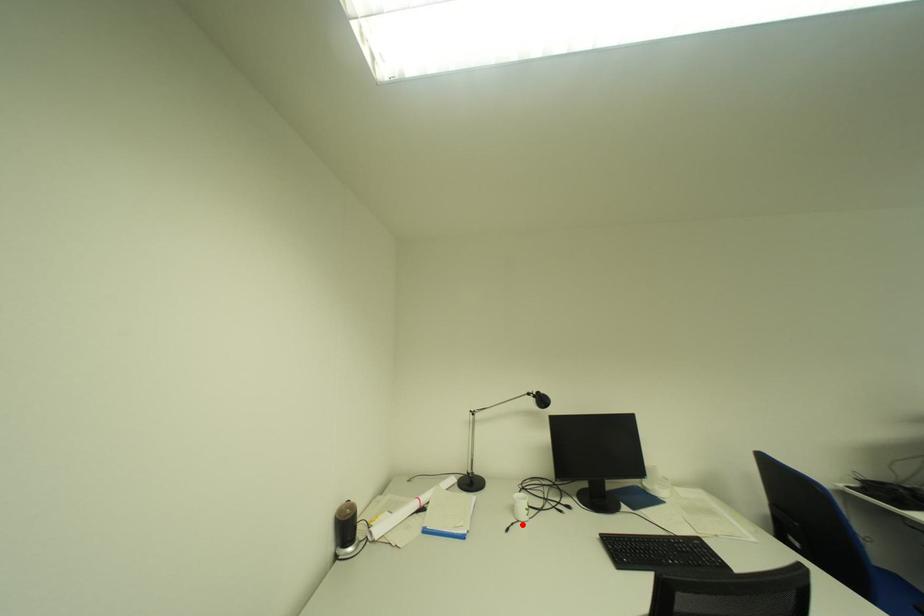
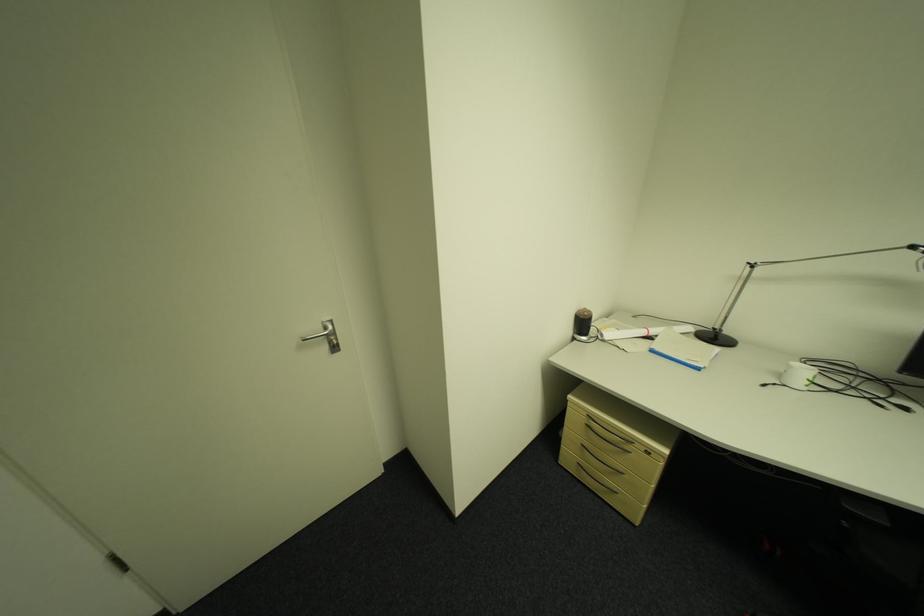
Locate, in the second image, the point that corresponds to the highlighted location in the first image.

(784, 386)